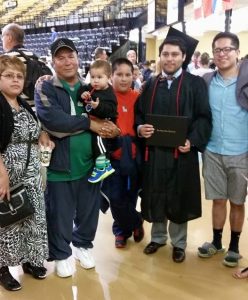
Where is `light colored wooden floor`? The image size is (248, 300). light colored wooden floor is located at coordinates (139, 273).